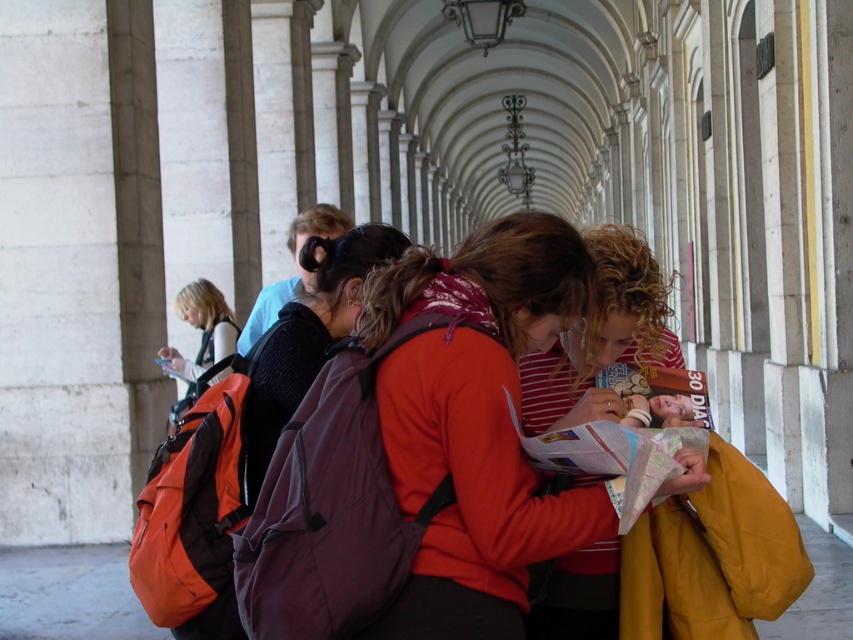
Question: Where is orange backpack at center located in relation to blonde hair at left in the image?

Choices:
 (A) above
 (B) below

Answer: (B)

Question: Which object appears closest to the camera in this image?

Choices:
 (A) orange backpack at center
 (B) red striped shirt at center
 (C) dark gray backpack at center

Answer: (A)

Question: Is red striped shirt at center to the right of dark gray backpack at center from the viewer's perspective?

Choices:
 (A) no
 (B) yes

Answer: (B)

Question: Which point is farther to the camera?

Choices:
 (A) (498, 614)
 (B) (306, 256)
 (C) (210, 317)

Answer: (C)

Question: Can you confirm if red striped shirt at center is bigger than dark gray backpack at center?

Choices:
 (A) no
 (B) yes

Answer: (A)

Question: Considering the real-world distances, which object is closest to the orange backpack at center?

Choices:
 (A) blonde hair at left
 (B) dark gray backpack at center

Answer: (B)